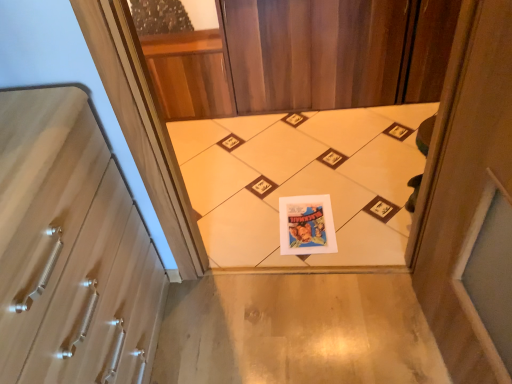
Question: Considering the positions of wooden at left and white paper print at center in the image, is wooden at left wider or thinner than white paper print at center?

Choices:
 (A) wide
 (B) thin

Answer: (B)

Question: Is wooden at left in front of or behind white paper print at center in the image?

Choices:
 (A) behind
 (B) front

Answer: (B)

Question: Considering the positions of point (76, 302) and point (276, 145), is point (76, 302) closer or farther from the camera than point (276, 145)?

Choices:
 (A) closer
 (B) farther

Answer: (A)

Question: In terms of width, does white paper print at center look wider or thinner when compared to wooden at left?

Choices:
 (A) thin
 (B) wide

Answer: (B)

Question: Considering the positions of point pos(343,155) and point pos(102,347), is point pos(343,155) closer or farther from the camera than point pos(102,347)?

Choices:
 (A) closer
 (B) farther

Answer: (B)

Question: Based on their positions, is white paper print at center located to the left or right of wooden at left?

Choices:
 (A) right
 (B) left

Answer: (A)

Question: From a real-world perspective, is white paper print at center physically located above or below wooden at left?

Choices:
 (A) below
 (B) above

Answer: (A)